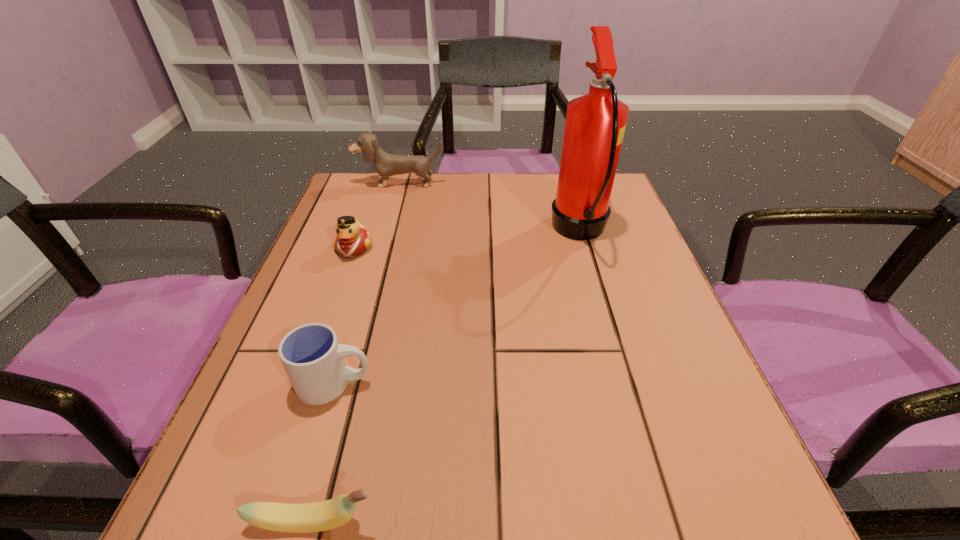
At what (x,y) coordinates should I click in order to perform the action: click on fire extinguisher. Please return your answer as a coordinate pair (x, y). This screenshot has width=960, height=540. Looking at the image, I should click on (595, 123).

You are a GUI agent. You are given a task and a screenshot of the screen. Output one action in this format:
    pyautogui.click(x=<x>, y=<y>)
    Task: Click on the tallest object
    Image resolution: width=960 pixels, height=540 pixels.
    Given the screenshot: What is the action you would take?
    pyautogui.click(x=595, y=123)

Image resolution: width=960 pixels, height=540 pixels. Find the location of `puppy`. puppy is located at coordinates (385, 164).

You are a GUI agent. You are given a task and a screenshot of the screen. Output one action in this format:
    pyautogui.click(x=<x>, y=<y>)
    Task: Click on the second tallest object
    This screenshot has width=960, height=540.
    Given the screenshot: What is the action you would take?
    pyautogui.click(x=385, y=164)

Image resolution: width=960 pixels, height=540 pixels. I want to click on cup, so 313,359.

Locate an element on the screen. This screenshot has height=540, width=960. duck is located at coordinates (352, 239).

The image size is (960, 540). I want to click on the nearest object, so click(318, 516).

Where is `vacant area located 0.180m at the spray nozzle of the tallest object`? vacant area located 0.180m at the spray nozzle of the tallest object is located at coordinates (474, 232).

Where is `free space located 0.190m at the spray nozzle of the tallest object`? The image size is (960, 540). free space located 0.190m at the spray nozzle of the tallest object is located at coordinates (469, 232).

Find the location of a particular element. free space located at the spray nozzle of the tallest object is located at coordinates (435, 232).